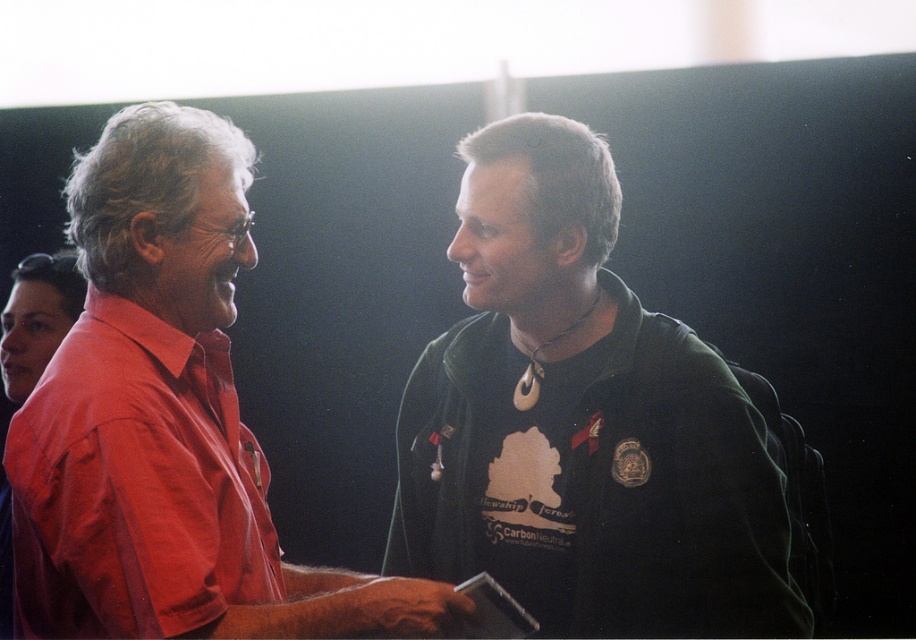
Is black matte shirt at center smaller than matte red shirt at left?

Indeed, black matte shirt at center has a smaller size compared to matte red shirt at left.

Is black matte shirt at center below matte red shirt at left?

Correct, black matte shirt at center is located below matte red shirt at left.

Where is `black matte shirt at center`? black matte shirt at center is located at coordinates (583, 422).